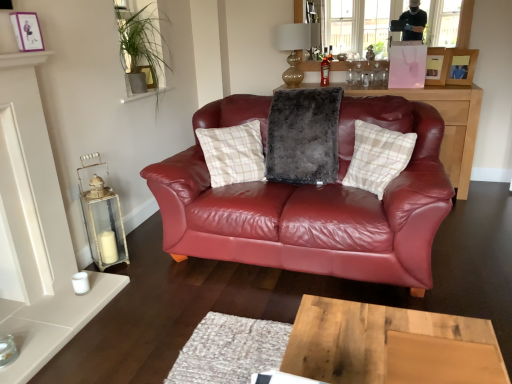
The width and height of the screenshot is (512, 384). What do you see at coordinates (378, 157) in the screenshot? I see `plaid fabric pillow at center, the 2th pillow in the left-to-right sequence` at bounding box center [378, 157].

Measure the distance between point [431,9] and camera.

The depth of point [431,9] is 11.56 feet.

What do you see at coordinates (437, 65) in the screenshot? I see `matte pink picture frame at upper right, positioned as the 2th picture frame in left-to-right order` at bounding box center [437, 65].

Image resolution: width=512 pixels, height=384 pixels. I want to click on matte black cabinet at center, so click(x=444, y=123).

From the image's perspective, is fuzzy gray pillow at center, which appears as the 1th pillow when viewed from the left, positioned above or below wooden desk at center?

fuzzy gray pillow at center, which appears as the 1th pillow when viewed from the left, is above wooden desk at center.

At what (x,y) coordinates should I click in order to perform the action: click on desk directly beneath the fuzzy gray pillow at center, which appears as the 1th pillow when viewed from the left (from a real-world perspective). Please return your answer as a coordinate pair (x, y). This screenshot has width=512, height=384. Looking at the image, I should click on (387, 345).

Based on the photo, which of these two, fuzzy gray pillow at center, arranged as the second pillow when viewed from the right, or wooden desk at center, is bigger?

Bigger between the two is fuzzy gray pillow at center, arranged as the second pillow when viewed from the right.

Can you confirm if wooden desk at center is smaller than translucent glass bottle at center?

No, wooden desk at center is not smaller than translucent glass bottle at center.

From the image's perspective, which one is positioned higher, wooden desk at center or translucent glass bottle at center?

translucent glass bottle at center appears higher in the image.

Considering the sizes of wooden desk at center and translucent glass bottle at center in the image, is wooden desk at center taller or shorter than translucent glass bottle at center?

wooden desk at center is taller than translucent glass bottle at center.

This screenshot has height=384, width=512. What are the coordinates of `desk on the left of the translucent glass bottle at center` in the screenshot? It's located at (387, 345).

I want to click on candle holder in front of the transparent glass window screen at upper center, so click(x=101, y=213).

Is white distressed wood lantern at left facing towards transparent glass window screen at upper center?

No, white distressed wood lantern at left is not facing towards transparent glass window screen at upper center.

Which object is wider, white distressed wood lantern at left or transparent glass window screen at upper center?

Wider between the two is white distressed wood lantern at left.

Consider the image. How much distance is there between fuzzy gray pillow at center, arranged as the second pillow when viewed from the right, and translucent glass bottle at center?

fuzzy gray pillow at center, arranged as the second pillow when viewed from the right, and translucent glass bottle at center are 4.12 feet apart.

Considering the relative sizes of fuzzy gray pillow at center, arranged as the second pillow when viewed from the right, and translucent glass bottle at center in the image provided, is fuzzy gray pillow at center, arranged as the second pillow when viewed from the right, bigger than translucent glass bottle at center?

Yes, fuzzy gray pillow at center, arranged as the second pillow when viewed from the right, is bigger than translucent glass bottle at center.

Is point (287, 150) positioned before point (323, 62)?

Yes, it is.

Is matte purple picture frame at upper left, which appears as the 3th picture frame when viewed from the right, shorter than transparent glass window screen at upper center?

Yes, matte purple picture frame at upper left, which appears as the 3th picture frame when viewed from the right, is shorter than transparent glass window screen at upper center.

Can you tell me how much matte purple picture frame at upper left, which appears as the 3th picture frame when viewed from the right, and transparent glass window screen at upper center differ in facing direction?

90.1 degrees separate the facing orientations of matte purple picture frame at upper left, which appears as the 3th picture frame when viewed from the right, and transparent glass window screen at upper center.

Considering the sizes of objects matte purple picture frame at upper left, the third picture frame in the back-to-front sequence, and transparent glass window screen at upper center in the image provided, who is wider, matte purple picture frame at upper left, the third picture frame in the back-to-front sequence, or transparent glass window screen at upper center?

transparent glass window screen at upper center is wider.

Considering the sizes of gold glass lampshade at upper center and matte black cabinet at center in the image, is gold glass lampshade at upper center taller or shorter than matte black cabinet at center?

Considering their sizes, gold glass lampshade at upper center has less height than matte black cabinet at center.

From the image's perspective, is gold glass lampshade at upper center located above or below matte black cabinet at center?

Based on their image positions, gold glass lampshade at upper center is located above matte black cabinet at center.

Is gold glass lampshade at upper center not close to matte black cabinet at center?

No, gold glass lampshade at upper center is in close proximity to matte black cabinet at center.

How distant is translucent glass bottle at center from white distressed wood lantern at left?

A distance of 2.21 meters exists between translucent glass bottle at center and white distressed wood lantern at left.

Who is smaller, translucent glass bottle at center or white distressed wood lantern at left?

translucent glass bottle at center.

Is translucent glass bottle at center outside of white distressed wood lantern at left?

translucent glass bottle at center is positioned outside white distressed wood lantern at left.

From the image's perspective, which is below, translucent glass bottle at center or white distressed wood lantern at left?

From the image's view, white distressed wood lantern at left is below.

You are a GUI agent. You are given a task and a screenshot of the screen. Output one action in this format:
    pyautogui.click(x=<x>, y=<y>)
    Task: Click on the pillow that is the 2nd one when counting backward from the wooden desk at center
    Image resolution: width=512 pixels, height=384 pixels.
    Given the screenshot: What is the action you would take?
    pyautogui.click(x=303, y=136)

Identify the location of bottle on the right of the wooden desk at center. The image size is (512, 384). (325, 71).

Considering their positions, is gold glass lampshade at upper center positioned closer to matte purple picture frame at upper left, which appears as the 3th picture frame when viewed from the right, than plaid fabric pillow at center, the 2th pillow in the left-to-right sequence?

The object closer to matte purple picture frame at upper left, which appears as the 3th picture frame when viewed from the right, is plaid fabric pillow at center, the 2th pillow in the left-to-right sequence.

Which object lies nearer to the anchor point matte pink picture frame at upper right, which ranks as the 2th picture frame in right-to-left order, fuzzy gray pillow at center, arranged as the second pillow when viewed from the right, or wooden picture frame at upper right, the first picture frame in the right-to-left sequence?

Based on the image, wooden picture frame at upper right, the first picture frame in the right-to-left sequence, appears to be nearer to matte pink picture frame at upper right, which ranks as the 2th picture frame in right-to-left order.

From the image, which object appears to be nearer to matte pink picture frame at upper right, positioned as the 2th picture frame in left-to-right order, white distressed wood lantern at left or wooden desk at center?

white distressed wood lantern at left is closer to matte pink picture frame at upper right, positioned as the 2th picture frame in left-to-right order.

From the picture: When comparing their distances from wooden desk at center, does fuzzy gray pillow at center, arranged as the second pillow when viewed from the right, or wooden picture frame at upper right, placed as the second picture frame when sorted from back to front, seem closer?

fuzzy gray pillow at center, arranged as the second pillow when viewed from the right.

In the scene shown: Based on their spatial positions, is plaid fabric pillow at center, the 2th pillow in the left-to-right sequence, or transparent glass window screen at upper center closer to matte black cabinet at center?

transparent glass window screen at upper center lies closer to matte black cabinet at center than the other object.

Based on their spatial positions, is matte pink picture frame at upper right, the first picture frame from the back, or white distressed wood lantern at left further from wooden desk at center?

The object further to wooden desk at center is matte pink picture frame at upper right, the first picture frame from the back.

When comparing their distances from white distressed wood lantern at left, does matte black cabinet at center or wooden desk at center seem closer?

The object closer to white distressed wood lantern at left is wooden desk at center.

Looking at the image, which one is located closer to matte black cabinet at center, matte purple picture frame at upper left, which appears as the 3th picture frame when viewed from the right, or fuzzy gray pillow at center, which appears as the 1th pillow when viewed from the left?

fuzzy gray pillow at center, which appears as the 1th pillow when viewed from the left, lies closer to matte black cabinet at center than the other object.

Where is `candle holder between wooden desk at center and gold glass lampshade at upper center in the front-back direction`? The width and height of the screenshot is (512, 384). candle holder between wooden desk at center and gold glass lampshade at upper center in the front-back direction is located at coordinates (101, 213).

Identify the location of bottle between gold glass lampshade at upper center and matte black cabinet at center from top to bottom. The height and width of the screenshot is (384, 512). (325, 71).

Locate an element on the screen. Image resolution: width=512 pixels, height=384 pixels. pillow between transparent glass window screen at upper center and plaid fabric pillow at center, which ranks as the 1th pillow in right-to-left order, in the up-down direction is located at coordinates (303, 136).

Locate an element on the screen. The height and width of the screenshot is (384, 512). lamp between matte purple picture frame at upper left, the third picture frame in the back-to-front sequence, and matte pink picture frame at upper right, the first picture frame from the back is located at coordinates (293, 49).